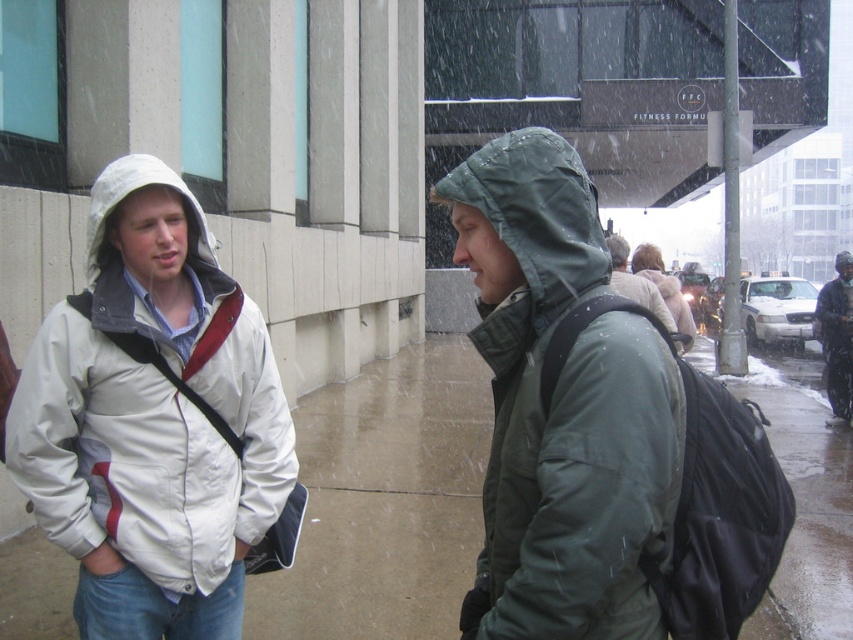
Does white matte jacket at left have a larger size compared to light gray woolen jacket at center?

Indeed, white matte jacket at left has a larger size compared to light gray woolen jacket at center.

Can you confirm if white matte jacket at left is wider than light gray woolen jacket at center?

Yes.

Between point (187, 307) and point (662, 301), which one is positioned behind?

Positioned behind is point (662, 301).

Where is `white matte jacket at left`? white matte jacket at left is located at coordinates (152, 410).

Is point (846, 266) positioned in front of point (640, 243)?

Yes, point (846, 266) is in front of point (640, 243).

Does dark gray hooded jacket at right appear over light beige wool coat at center?

No, dark gray hooded jacket at right is not above light beige wool coat at center.

Is point (833, 413) less distant than point (682, 332)?

No, it is not.

Find the location of `dark gray hooded jacket at right`. dark gray hooded jacket at right is located at coordinates (837, 337).

Does point (521, 276) come farther from viewer compared to point (683, 312)?

No.

Between green matte jacket at center and light beige wool coat at center, which one is positioned lower?

green matte jacket at center is lower down.

Does point (665, 538) come closer to viewer compared to point (670, 275)?

Yes, it is in front of point (670, 275).

At what (x,y) coordinates should I click in order to perform the action: click on green matte jacket at center. Please return your answer as a coordinate pair (x, y). The image size is (853, 640). Looking at the image, I should click on (561, 406).